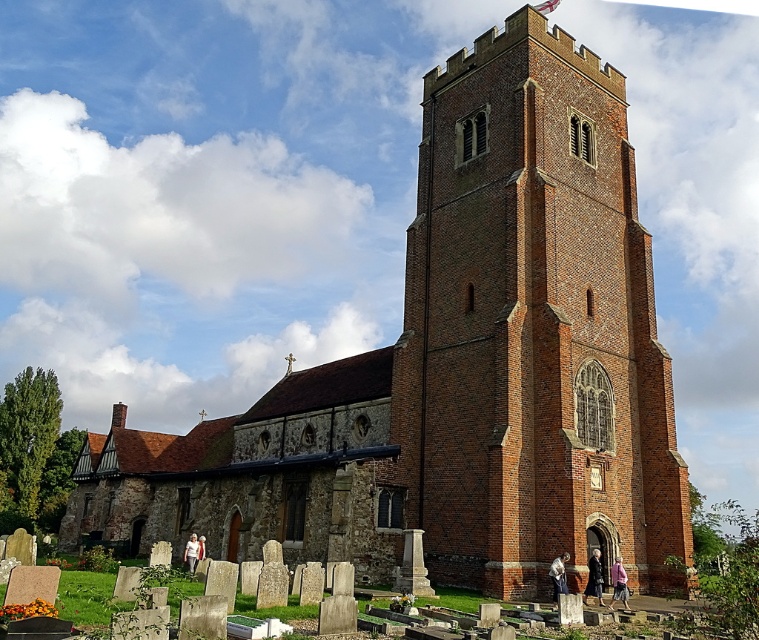
You are standing in front of the historic church and notice the brick tower at center and the dark gray wool coat at lower center. From your perspective, which object is located higher in the image?

The brick tower at center is positioned over the dark gray wool coat at lower center, so it is higher in the image.

You are standing in front of the historic church and want to take a photo of the brick tower at center. If you are positioned at point 0, which direction should you face to capture the tower in your shot?

The brick tower at center is located at point [531,326], so you should face towards the center of the image to capture it in your photo.

You are standing in front of the historic church described in the scene. If you want to locate the brick tower at center, where would you look?

The brick tower at center is located at the point with coordinates 0.512 on the x axis and 0.702 on the y axis.